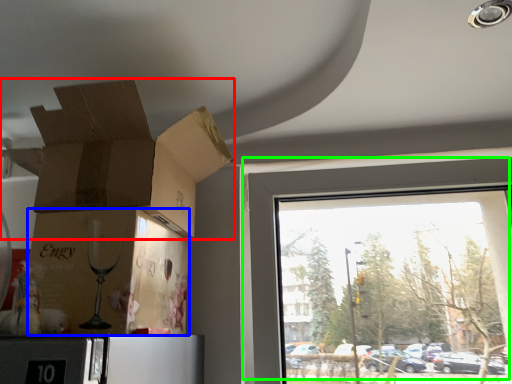
Question: Which object is the closest to the cardboard box (highlighted by a red box)? Choose among these: cardboard box (highlighted by a blue box) or window (highlighted by a green box).

Choices:
 (A) cardboard box
 (B) window

Answer: (A)